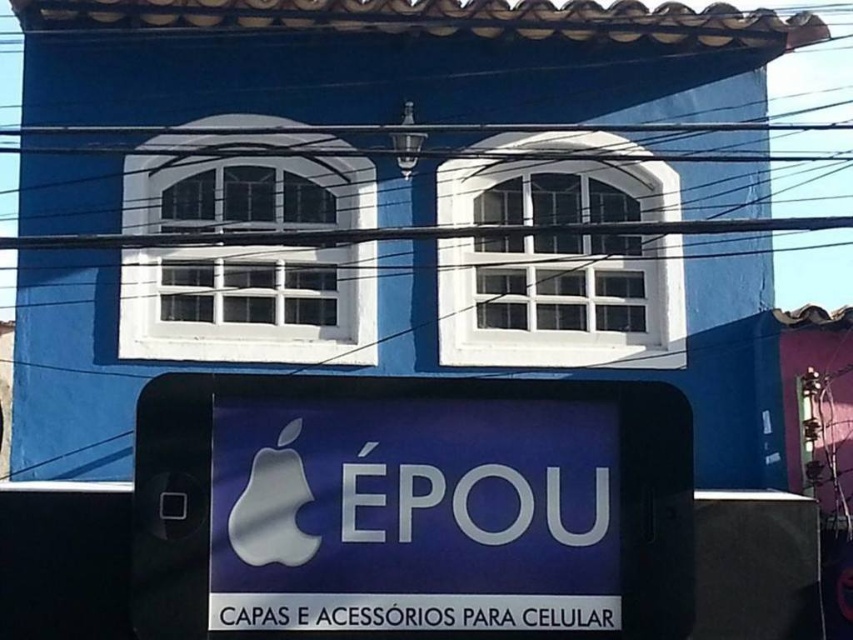
Which of these two, white plastic phone at center or satin silver apple at center, stands shorter?

Standing shorter between the two is satin silver apple at center.

Does white plastic phone at center have a greater height compared to satin silver apple at center?

Correct, white plastic phone at center is much taller as satin silver apple at center.

Measure the distance between white plastic phone at center and camera.

white plastic phone at center is 7.64 meters from camera.

Identify the location of white plastic phone at center. (410, 508).